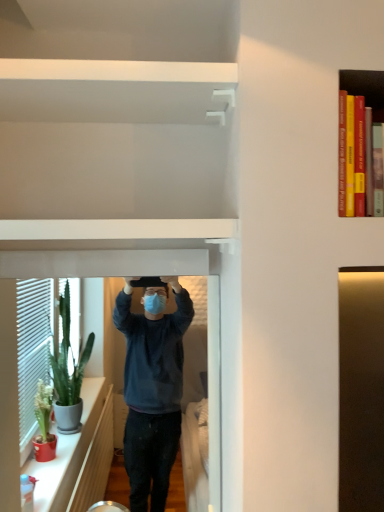
What do you see at coordinates (58, 477) in the screenshot?
I see `clear glass window frame at left` at bounding box center [58, 477].

What is the approximate height of clear glass window frame at left?

25.10 inches.

Find the location of a particular element. clear glass window frame at left is located at coordinates (58, 477).

In order to face clear glass window frame at left, should I rotate leftwards or rightwards?

To face it directly, rotate left by 10.366 degrees.

Identify the location of clear glass window frame at left. This screenshot has width=384, height=512. (58, 477).